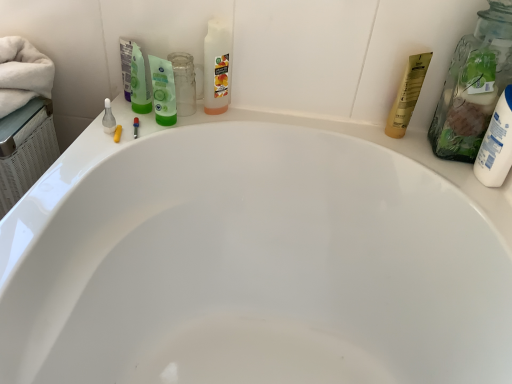
Question: Does yellow matte tube at upper right, the first toiletry when ordered from back to front, appear on the left side of white matte lotion at right, arranged as the second toiletry when viewed from the back?

Choices:
 (A) yes
 (B) no

Answer: (A)

Question: From a real-world perspective, is yellow matte tube at upper right, placed as the first toiletry when sorted from left to right, located beneath white matte lotion at right, marked as the first toiletry in a right-to-left arrangement?

Choices:
 (A) no
 (B) yes

Answer: (B)

Question: Would you say yellow matte tube at upper right, the second toiletry from the right, is outside white matte lotion at right, marked as the first toiletry in a right-to-left arrangement?

Choices:
 (A) no
 (B) yes

Answer: (B)

Question: Is yellow matte tube at upper right, placed as the first toiletry when sorted from left to right, further to camera compared to white matte lotion at right, arranged as the second toiletry when viewed from the back?

Choices:
 (A) yes
 (B) no

Answer: (A)

Question: Could you tell me if yellow matte tube at upper right, the first toiletry when ordered from back to front, is facing white matte lotion at right, the first toiletry viewed from the front?

Choices:
 (A) yes
 (B) no

Answer: (B)

Question: Is point 411,64 closer or farther from the camera than point 173,92?

Choices:
 (A) closer
 (B) farther

Answer: (B)

Question: From the image's perspective, is yellow matte tube at upper right, the second toiletry from the right, positioned above or below green matte mouthwash at upper center?

Choices:
 (A) above
 (B) below

Answer: (B)

Question: Which is correct: yellow matte tube at upper right, placed as the first toiletry when sorted from left to right, is inside green matte mouthwash at upper center, or outside of it?

Choices:
 (A) inside
 (B) outside

Answer: (B)

Question: Considering the positions of yellow matte tube at upper right, placed as the first toiletry when sorted from left to right, and green matte mouthwash at upper center in the image, is yellow matte tube at upper right, placed as the first toiletry when sorted from left to right, bigger or smaller than green matte mouthwash at upper center?

Choices:
 (A) big
 (B) small

Answer: (A)

Question: In the image, is white matte lotion at right, the first toiletry viewed from the front, on the left side or the right side of yellow matte tube at upper right, the 2th toiletry viewed from the front?

Choices:
 (A) left
 (B) right

Answer: (B)

Question: From a real-world perspective, is white matte lotion at right, the first toiletry viewed from the front, above or below yellow matte tube at upper right, the 2th toiletry viewed from the front?

Choices:
 (A) below
 (B) above

Answer: (B)

Question: Relative to yellow matte tube at upper right, the 2th toiletry viewed from the front, is white matte lotion at right, the first toiletry viewed from the front, in front or behind?

Choices:
 (A) behind
 (B) front

Answer: (B)

Question: Do you think white matte lotion at right, marked as the first toiletry in a right-to-left arrangement, is within yellow matte tube at upper right, the second toiletry from the right, or outside of it?

Choices:
 (A) inside
 (B) outside

Answer: (B)

Question: Looking at the image, does yellow matte tube at upper right, the first toiletry when ordered from back to front, seem bigger or smaller compared to translucent glass jar at upper right?

Choices:
 (A) big
 (B) small

Answer: (B)

Question: Does point (399, 89) appear closer or farther from the camera than point (474, 49)?

Choices:
 (A) closer
 (B) farther

Answer: (B)